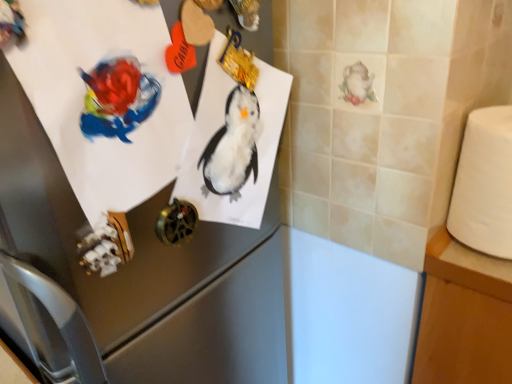
Identify the location of satin silver refrigerator at upper left. The height and width of the screenshot is (384, 512). (147, 271).

Identify the location of white wood table at right. The width and height of the screenshot is (512, 384). (464, 316).

Locate an element on the screen. This screenshot has width=512, height=384. matte paper penguin at upper left is located at coordinates [x=104, y=97].

The image size is (512, 384). What are the coordinates of `white matte toilet paper at right` in the screenshot? It's located at (484, 184).

Considering the relative sizes of matte paper penguin at upper left and white wood table at right in the image provided, is matte paper penguin at upper left bigger than white wood table at right?

Incorrect, matte paper penguin at upper left is not larger than white wood table at right.

Can you confirm if matte paper penguin at upper left is thinner than white wood table at right?

Correct, the width of matte paper penguin at upper left is less than that of white wood table at right.

Could you tell me if matte paper penguin at upper left is facing white wood table at right?

No, matte paper penguin at upper left is not aimed at white wood table at right.

Which of these two, matte paper penguin at upper left or white wood table at right, stands shorter?

With less height is matte paper penguin at upper left.

Relative to white matte toilet paper at right, is matte paper penguin at upper left in front or behind?

In the image, matte paper penguin at upper left appears in front of white matte toilet paper at right.

Based on their positions, is matte paper penguin at upper left located to the left or right of white matte toilet paper at right?

In the image, matte paper penguin at upper left appears on the left side of white matte toilet paper at right.

This screenshot has width=512, height=384. Identify the location of toilet paper below the matte paper penguin at upper left (from a real-world perspective). (484, 184).

Which object is wider, matte paper penguin at upper left or white matte toilet paper at right?

Wider between the two is white matte toilet paper at right.

Between satin silver refrigerator at upper left and matte paper penguin at upper left, which one has larger width?

Wider between the two is satin silver refrigerator at upper left.

From a real-world perspective, is satin silver refrigerator at upper left positioned over matte paper penguin at upper left based on gravity?

Actually, satin silver refrigerator at upper left is physically below matte paper penguin at upper left in the real world.

Does satin silver refrigerator at upper left lie behind matte paper penguin at upper left?

That is False.

Which is behind, point (213, 15) or point (170, 92)?

Positioned behind is point (213, 15).

Is point (458, 342) positioned in front of point (80, 46)?

No, (458, 342) is further to viewer.

From a real-world perspective, between white wood table at right and matte paper penguin at upper left, who is vertically higher?

matte paper penguin at upper left, from a real-world perspective.

Is white wood table at right bigger than matte paper penguin at upper left?

Yes.

Does white wood table at right have a greater width compared to matte paper penguin at upper left?

Yes.

From a real-world perspective, which object stands above the other?

white matte toilet paper at right is physically above.

Identify the location of toilet paper above the white wood table at right (from a real-world perspective). This screenshot has height=384, width=512. (484, 184).

Is white wood table at right next to white matte toilet paper at right and touching it?

There is a gap between white wood table at right and white matte toilet paper at right.

Which object is closer to the camera taking this photo, white wood table at right or white matte toilet paper at right?

Positioned in front is white matte toilet paper at right.

How different are the orientations of white matte toilet paper at right and white wood table at right in degrees?

1.52 degrees separate the facing orientations of white matte toilet paper at right and white wood table at right.

The image size is (512, 384). Find the location of `toilet paper that is in front of the white wood table at right`. toilet paper that is in front of the white wood table at right is located at coordinates (484, 184).

From a real-world perspective, is white matte toilet paper at right over white wood table at right?

Yes, from a real-world perspective, white matte toilet paper at right is over white wood table at right

Is the surface of white matte toilet paper at right in direct contact with white wood table at right?

No, white matte toilet paper at right is not next to white wood table at right.

Can you tell me how much matte paper penguin at upper left and satin silver refrigerator at upper left differ in facing direction?

matte paper penguin at upper left and satin silver refrigerator at upper left are facing 5.37 degrees away from each other.

From the image's perspective, is matte paper penguin at upper left positioned above or below satin silver refrigerator at upper left?

Based on their image positions, matte paper penguin at upper left is located above satin silver refrigerator at upper left.

Between matte paper penguin at upper left and satin silver refrigerator at upper left, which one has larger size?

satin silver refrigerator at upper left is bigger.

Is matte paper penguin at upper left looking in the opposite direction of satin silver refrigerator at upper left?

Correct, matte paper penguin at upper left is looking away from satin silver refrigerator at upper left.

I want to click on paper that appears in front of the white wood table at right, so click(x=104, y=97).

At what (x,y) coordinates should I click in order to perform the action: click on toilet paper below the matte paper penguin at upper left (from the image's perspective). Please return your answer as a coordinate pair (x, y). This screenshot has width=512, height=384. Looking at the image, I should click on (484, 184).

From the image, which object appears to be farther from matte paper penguin at upper left, white matte toilet paper at right or white wood table at right?

Among the two, white wood table at right is located further to matte paper penguin at upper left.

Considering their positions, is satin silver refrigerator at upper left positioned closer to matte paper penguin at upper left than white wood table at right?

Among the two, satin silver refrigerator at upper left is located nearer to matte paper penguin at upper left.

Which object lies further to the anchor point white matte toilet paper at right, white wood table at right or satin silver refrigerator at upper left?

satin silver refrigerator at upper left lies further to white matte toilet paper at right than the other object.

Looking at the image, which one is located closer to white wood table at right, matte paper penguin at upper left or white matte toilet paper at right?

white matte toilet paper at right is positioned closer to the anchor white wood table at right.

Estimate the real-world distances between objects in this image. Which object is further from matte paper penguin at upper left, satin silver refrigerator at upper left or white matte toilet paper at right?

The object further to matte paper penguin at upper left is white matte toilet paper at right.

Which object lies nearer to the anchor point matte paper penguin at upper left, white matte toilet paper at right or satin silver refrigerator at upper left?

Among the two, satin silver refrigerator at upper left is located nearer to matte paper penguin at upper left.

Looking at the image, which one is located closer to satin silver refrigerator at upper left, white matte toilet paper at right or matte paper penguin at upper left?

matte paper penguin at upper left is closer to satin silver refrigerator at upper left.

From the image, which object appears to be farther from white wood table at right, matte paper penguin at upper left or satin silver refrigerator at upper left?

matte paper penguin at upper left is further to white wood table at right.

The height and width of the screenshot is (384, 512). Identify the location of toilet paper situated between matte paper penguin at upper left and white wood table at right from left to right. click(x=484, y=184).

Where is `toilet paper between satin silver refrigerator at upper left and white wood table at right in the horizontal direction`? The image size is (512, 384). toilet paper between satin silver refrigerator at upper left and white wood table at right in the horizontal direction is located at coordinates (484, 184).

The height and width of the screenshot is (384, 512). Identify the location of appliance between matte paper penguin at upper left and white wood table at right in the horizontal direction. (147, 271).

At what (x,y) coordinates should I click in order to perform the action: click on appliance between matte paper penguin at upper left and white matte toilet paper at right. Please return your answer as a coordinate pair (x, y). The width and height of the screenshot is (512, 384). Looking at the image, I should click on (147, 271).